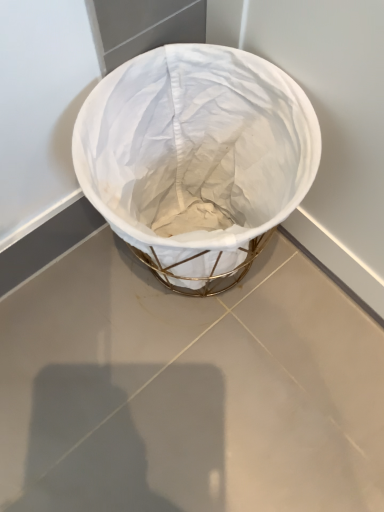
The image size is (384, 512). I want to click on white fabric waste container at center, so click(x=196, y=159).

The height and width of the screenshot is (512, 384). What do you see at coordinates (196, 159) in the screenshot?
I see `white fabric waste container at center` at bounding box center [196, 159].

What is the approximate width of white fabric waste container at center?

white fabric waste container at center is 24.79 centimeters in width.

Locate an element on the screen. This screenshot has width=384, height=512. white fabric waste container at center is located at coordinates (196, 159).